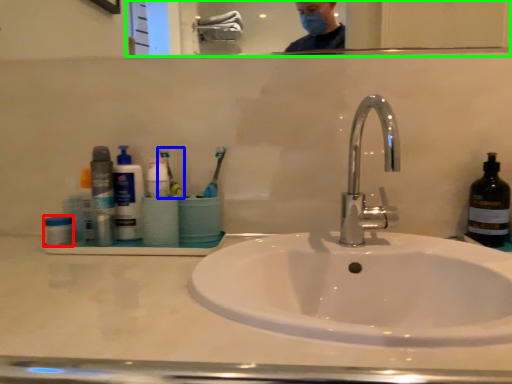
Question: Which is farther away from mouthwash (highlighted by a red box)? toothbrush (highlighted by a blue box) or mirror (highlighted by a green box)?

Choices:
 (A) toothbrush
 (B) mirror

Answer: (B)